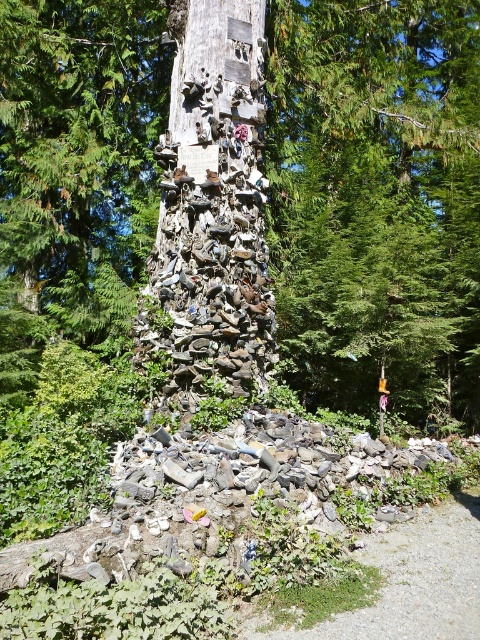
You are a hiker who wants to retrieve a shoe from the wooden post. You notice the wooden shoe at center and the shiny metallic shoes at center. Which shoe is positioned lower on the post?

The wooden shoe at center is positioned lower on the post because it is below the shiny metallic shoes at center.

You are a hiker who wants to hang a new pair of boots on the wooden post. The boots are taller than the wooden shoe at center. Where should you place them compared to the shiny metallic shoes at center?

The wooden shoe at center is much taller than the shiny metallic shoes at center. Since your boots are taller than the wooden shoe at center, they should be placed above both the wooden shoe at center and the shiny metallic shoes at center to maintain the height order.

You are standing in front of the wooden post with shoes and want to touch both the point at coordinates point (142, 3) and point (190, 355). Which point will you reach first?

You will reach point (142, 3) first because it is closer to you than point (190, 355), which is further away.